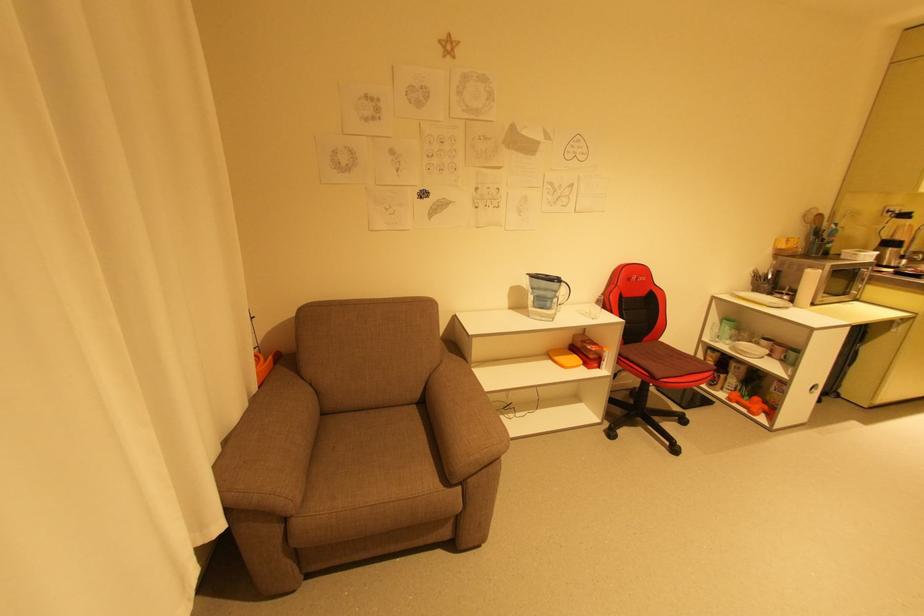
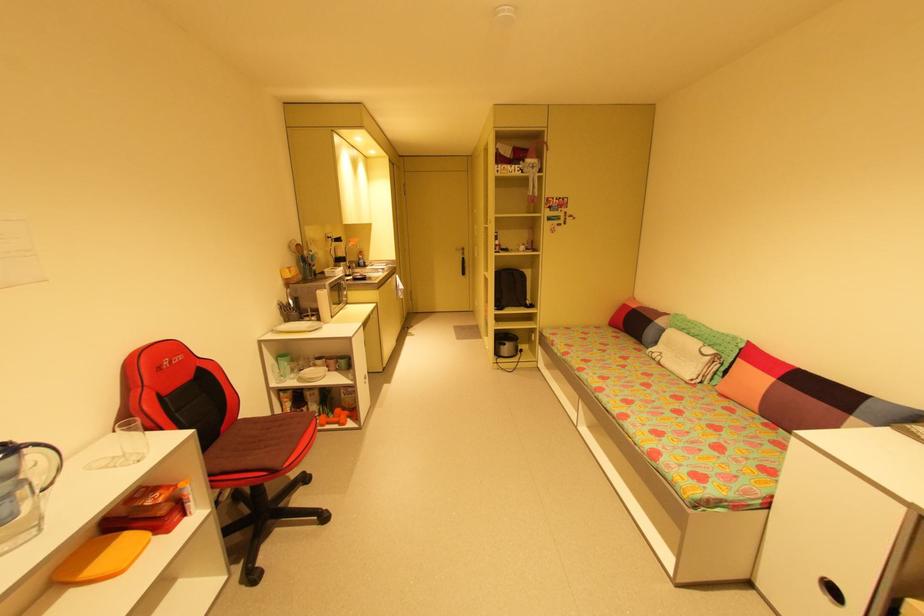
The point at (598,317) is marked in the first image. Where is the corresponding point in the second image?

(139, 459)